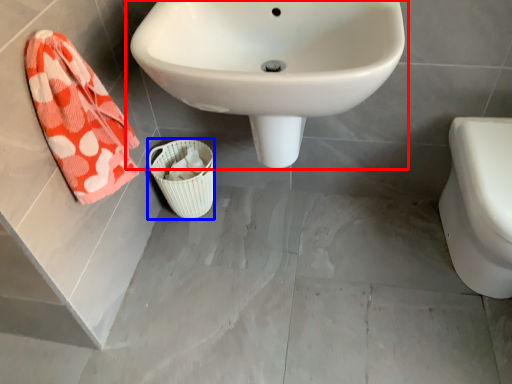
Question: Which point is further to the camera, sink (highlighted by a red box) or basket (highlighted by a blue box)?

Choices:
 (A) sink
 (B) basket

Answer: (B)